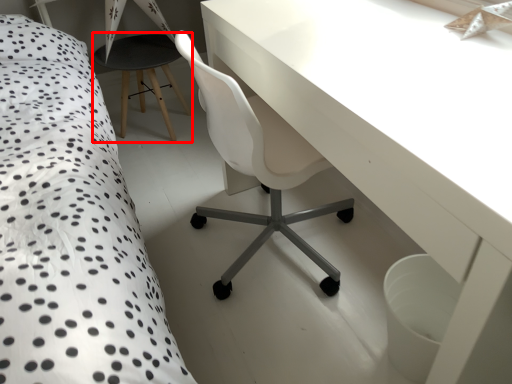
Question: From the image's perspective, what is the correct spatial positioning of bar stool (annotated by the red box) in reference to table?

Choices:
 (A) above
 (B) below

Answer: (A)